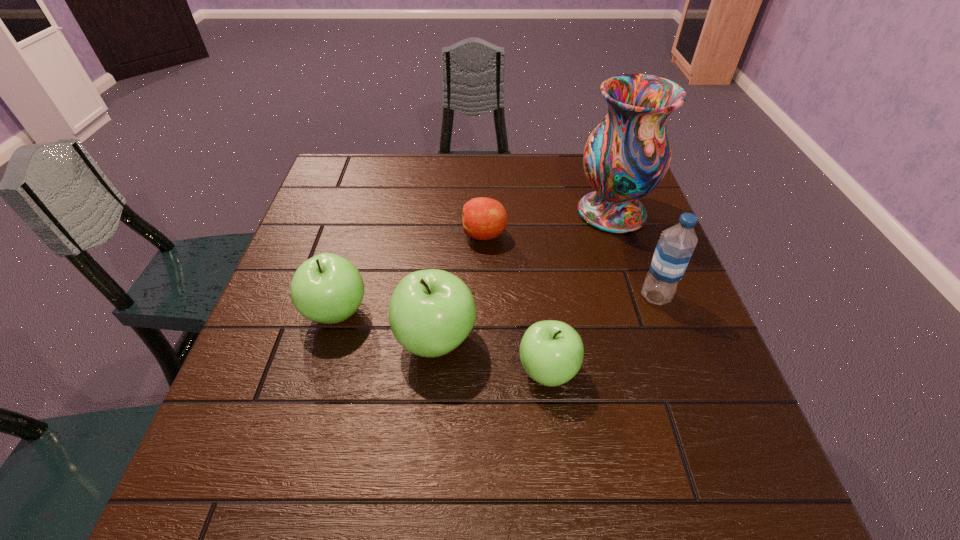
Considering the uniform spacing of apples, where should an additional apple be positioned on the right? Please locate a free spot. Please provide its 2D coordinates. Your answer should be formatted as a tuple, i.e. [(x, y)], where the tuple contains the x and y coordinates of a point satisfying the conditions above.

[(673, 406)]